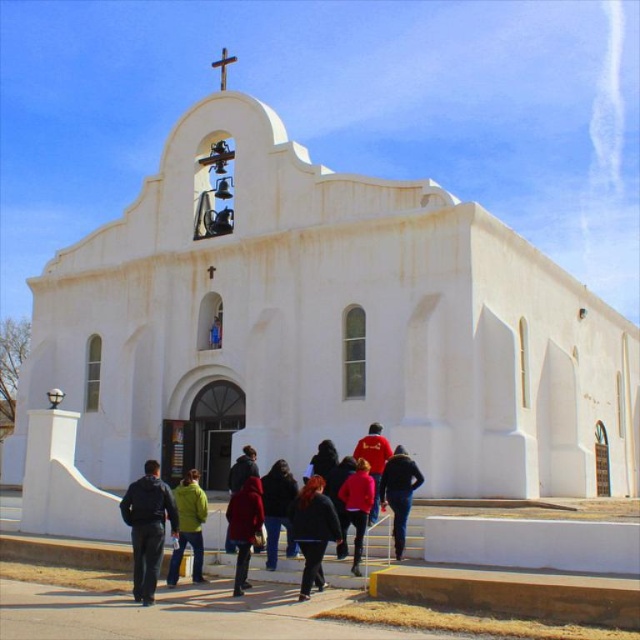
Question: Is green matte jacket at lower center smaller than dark red jacket at center?

Choices:
 (A) no
 (B) yes

Answer: (A)

Question: Which point is closer to the camera taking this photo?

Choices:
 (A) (300, 515)
 (B) (269, 524)

Answer: (A)

Question: Which point is farther to the camera?

Choices:
 (A) red cotton shirt at center
 (B) dark red jacket at center

Answer: (A)

Question: Can you confirm if black leather jacket at center is positioned to the right of dark red jacket at center?

Choices:
 (A) no
 (B) yes

Answer: (B)

Question: Is dark blue jeans at center positioned before matte red jacket at center?

Choices:
 (A) yes
 (B) no

Answer: (B)

Question: Which point is closer to the camera?

Choices:
 (A) black leather jacket at center
 (B) dark blue jacket at lower left
 (C) dark blue jeans at center

Answer: (B)